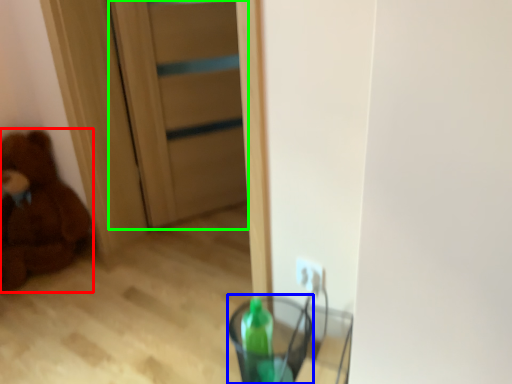
Question: Estimate the real-world distances between objects in this image. Which object is closer to teddy bear (highlighted by a red box), glass vase (highlighted by a blue box) or door (highlighted by a green box)?

Choices:
 (A) glass vase
 (B) door

Answer: (B)